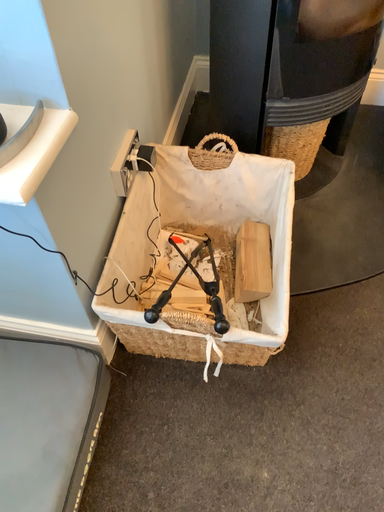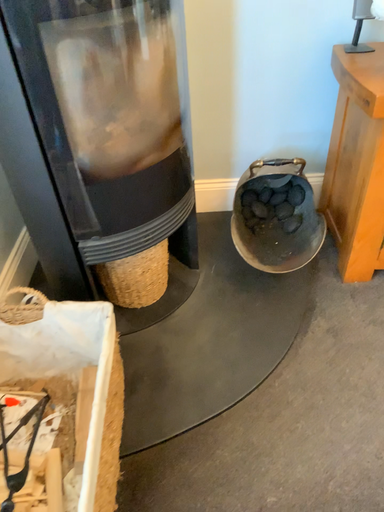
Question: How did the camera likely rotate when shooting the video?

Choices:
 (A) rotated upward
 (B) rotated downward

Answer: (A)